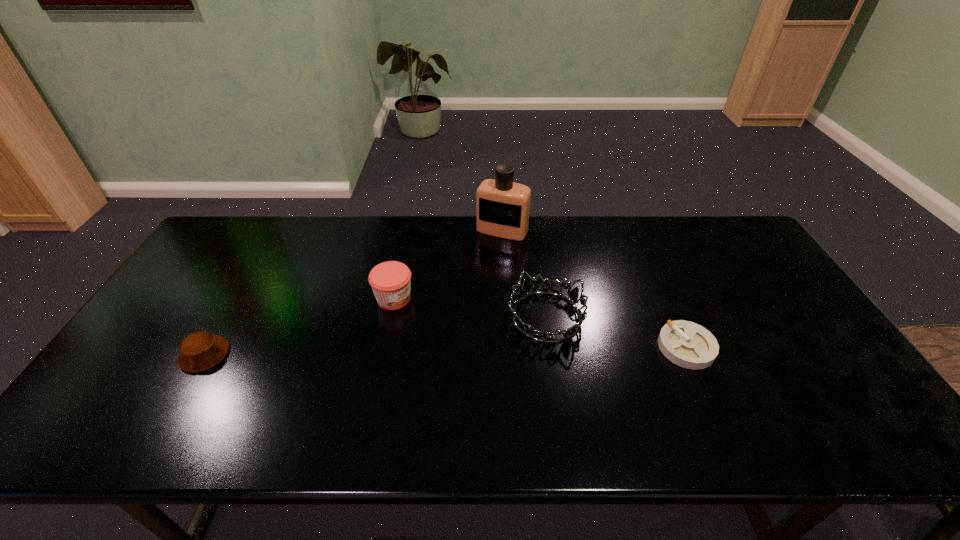
Locate an element on the screen. vacant space situated on the front label of the fourth object from right to left is located at coordinates (445, 320).

The image size is (960, 540). Find the location of `vacant space located on the front label of the fourth object from right to left`. vacant space located on the front label of the fourth object from right to left is located at coordinates [x=443, y=319].

What are the coordinates of `free space located on the front label of the fourth object from right to left` in the screenshot? It's located at (455, 325).

The width and height of the screenshot is (960, 540). I want to click on vacant space located on the front label of the tallest object, so click(471, 281).

You are a GUI agent. You are given a task and a screenshot of the screen. Output one action in this format:
    pyautogui.click(x=<x>, y=<y>)
    Task: Click on the vacant space located on the front label of the tallest object
    The height and width of the screenshot is (540, 960).
    Given the screenshot: What is the action you would take?
    pyautogui.click(x=468, y=288)

The image size is (960, 540). Identify the location of vacant position located 0.070m on the front label of the tallest object. (488, 253).

Identify the location of vacant space located on the front-facing side of the tiara. [393, 395].

I want to click on free location located on the front-facing side of the tiara, so 474,353.

Where is `free space located 0.340m on the front-facing side of the tiara`? The image size is (960, 540). free space located 0.340m on the front-facing side of the tiara is located at coordinates (400, 390).

I want to click on object positioned at the far edge, so click(x=502, y=206).